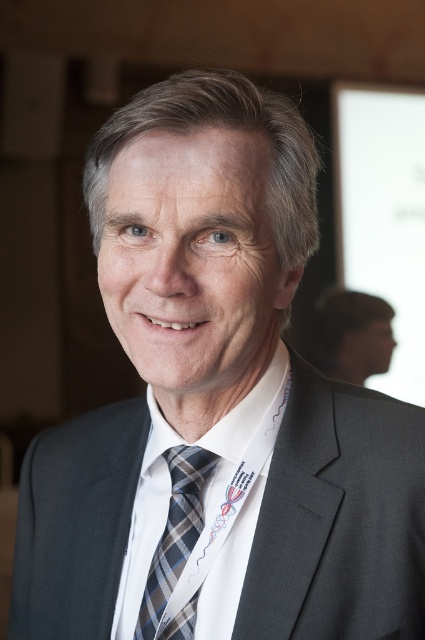
Based on the photo, is white woven dress shirt at center to the right of matte black suit at right from the viewer's perspective?

Incorrect, white woven dress shirt at center is not on the right side of matte black suit at right.

From the picture: Which is more to the right, white woven dress shirt at center or matte black suit at right?

matte black suit at right is more to the right.

The height and width of the screenshot is (640, 425). Identify the location of white woven dress shirt at center. (232, 502).

In order to click on white woven dress shirt at center in this screenshot , I will do `click(232, 502)`.

Measure the distance from plaid silk tie at center to matte black suit at right.

plaid silk tie at center and matte black suit at right are 2.15 meters apart from each other.

The height and width of the screenshot is (640, 425). Identify the location of plaid silk tie at center. (175, 531).

Which of these two, white woven dress shirt at center or plaid silk tie at center, stands shorter?

With less height is plaid silk tie at center.

Describe the element at coordinates (232, 502) in the screenshot. The image size is (425, 640). I see `white woven dress shirt at center` at that location.

Between point (200, 632) and point (172, 490), which one is positioned behind?

The point (172, 490) is more distant.

This screenshot has height=640, width=425. Find the location of `white woven dress shirt at center`. white woven dress shirt at center is located at coordinates (232, 502).